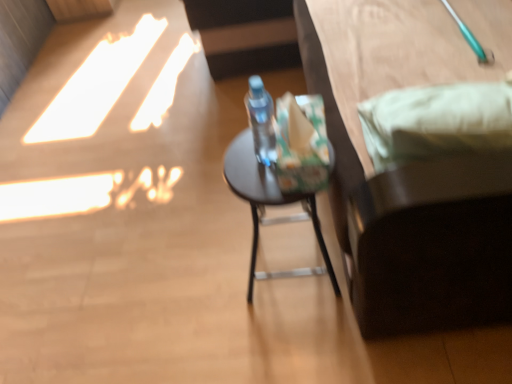
I want to click on vacant area to the left of matte black stool at center, so click(212, 278).